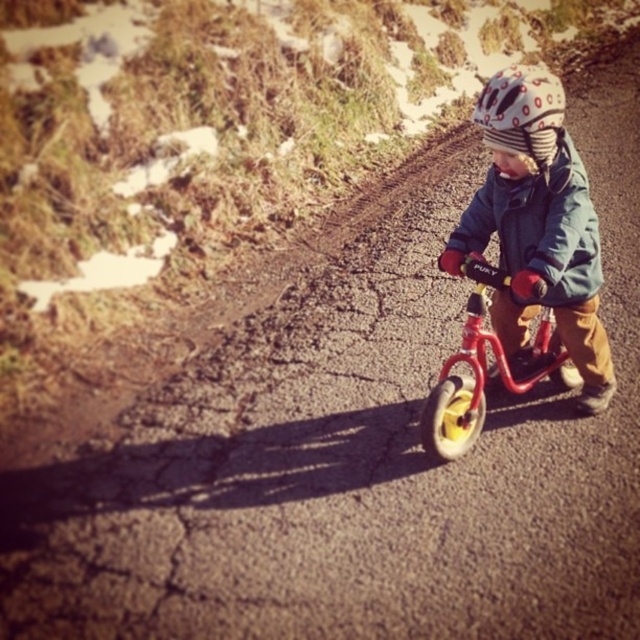
Which is more to the right, metallic red bicycle at center or white dotted helmet at center?

metallic red bicycle at center

Does point (464, 448) lie in front of point (538, 113)?

No, it is behind (538, 113).

The height and width of the screenshot is (640, 640). I want to click on metallic red bicycle at center, so click(x=484, y=369).

Which is in front, point (525, 320) or point (557, 259)?

Positioned in front is point (557, 259).

What are the coordinates of `matte blue jacket at center` in the screenshot? It's located at (536, 227).

Is blue fleece jacket at center below white dotted helmet at center?

Yes, blue fleece jacket at center is below white dotted helmet at center.

Who is shorter, blue fleece jacket at center or white dotted helmet at center?

A: Standing shorter between the two is white dotted helmet at center.

You are a GUI agent. You are given a task and a screenshot of the screen. Output one action in this format:
    pyautogui.click(x=<x>, y=<y>)
    Task: Click on the blue fleece jacket at center
    
    Given the screenshot: What is the action you would take?
    pyautogui.click(x=538, y=225)

The height and width of the screenshot is (640, 640). Identify the location of blue fleece jacket at center. (538, 225).